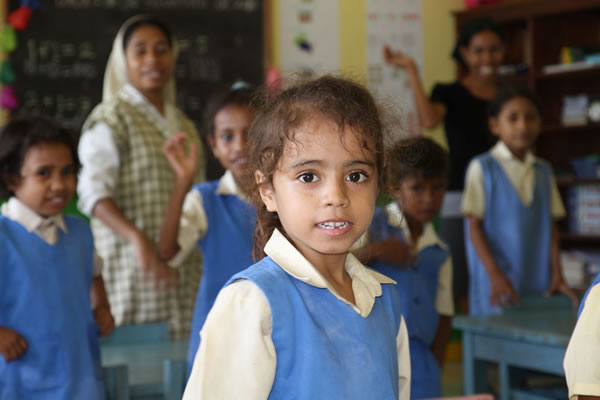
The height and width of the screenshot is (400, 600). I want to click on cornflower blue desks, so click(136, 347), click(508, 335).